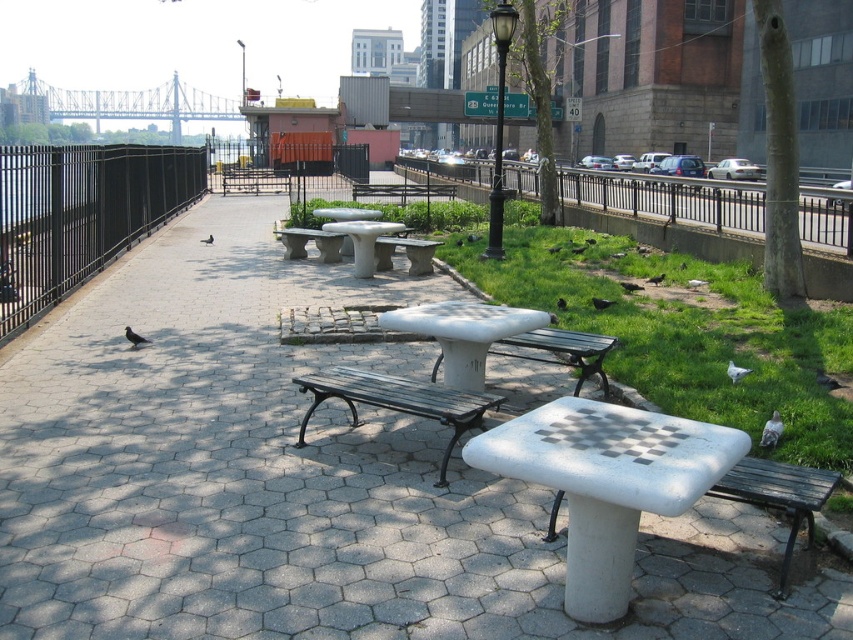
Question: Which point is farther to the camera?

Choices:
 (A) (805, 492)
 (B) (511, 314)
 (C) (370, 392)

Answer: (B)

Question: Estimate the real-world distances between objects in this image. Which object is closer to the white concrete bench at center?

Choices:
 (A) black metal fence at right
 (B) black metal fence at left

Answer: (B)

Question: Does black wrought iron bench at center lie behind wooden park bench at lower right?

Choices:
 (A) yes
 (B) no

Answer: (A)

Question: Which object appears closest to the camera in this image?

Choices:
 (A) green grass at center
 (B) white concrete bench at center

Answer: (B)

Question: From the image, what is the correct spatial relationship of white concrete bench at center in relation to white concrete picnic table at center?

Choices:
 (A) below
 (B) above

Answer: (B)

Question: Is white concrete picnic table at center to the left of black metal fence at left from the viewer's perspective?

Choices:
 (A) no
 (B) yes

Answer: (A)